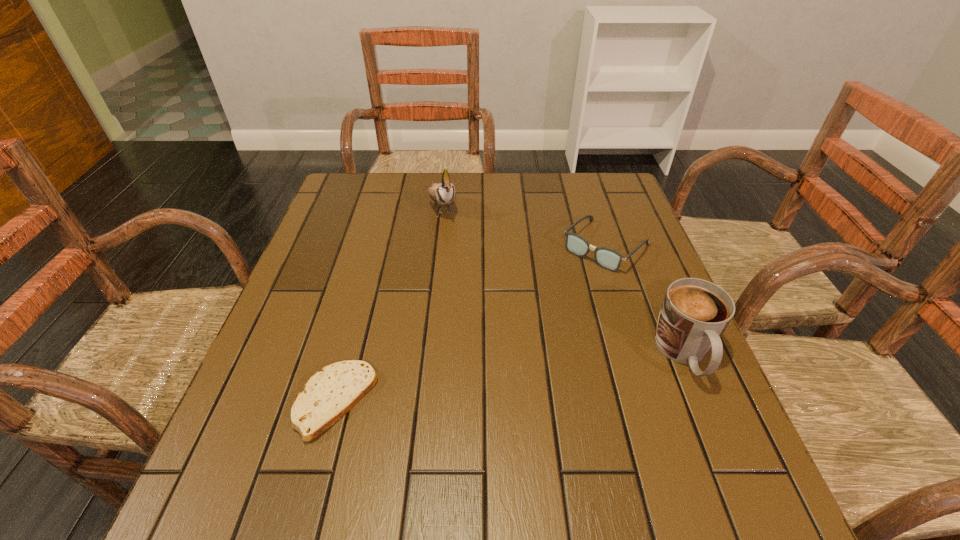
Find the location of a particular element. This screenshot has height=540, width=960. the shortest object is located at coordinates (328, 395).

You are a GUI agent. You are given a task and a screenshot of the screen. Output one action in this format:
    pyautogui.click(x=<x>, y=<y>)
    Task: Click on the leftmost object
    
    Given the screenshot: What is the action you would take?
    pyautogui.click(x=328, y=395)

Where is `the third shortest object`? the third shortest object is located at coordinates (694, 314).

Identify the location of the third tallest object. The image size is (960, 540). (609, 259).

This screenshot has width=960, height=540. Find the location of `the tallest object`. the tallest object is located at coordinates (443, 193).

Find the location of a particular element. bird is located at coordinates (443, 193).

The width and height of the screenshot is (960, 540). Identify the location of vacant space located 0.050m on the left of the pita bread. (269, 401).

Find the location of `blank space located on the face of the spectacles`. blank space located on the face of the spectacles is located at coordinates (548, 305).

Where is `free region located on the face of the spectacles`? free region located on the face of the spectacles is located at coordinates (522, 330).

At what (x,y) coordinates should I click in order to perform the action: click on vacant space situated 0.050m on the face of the spectacles. Please return your answer as a coordinate pair (x, y). The height and width of the screenshot is (540, 960). Looking at the image, I should click on (573, 279).